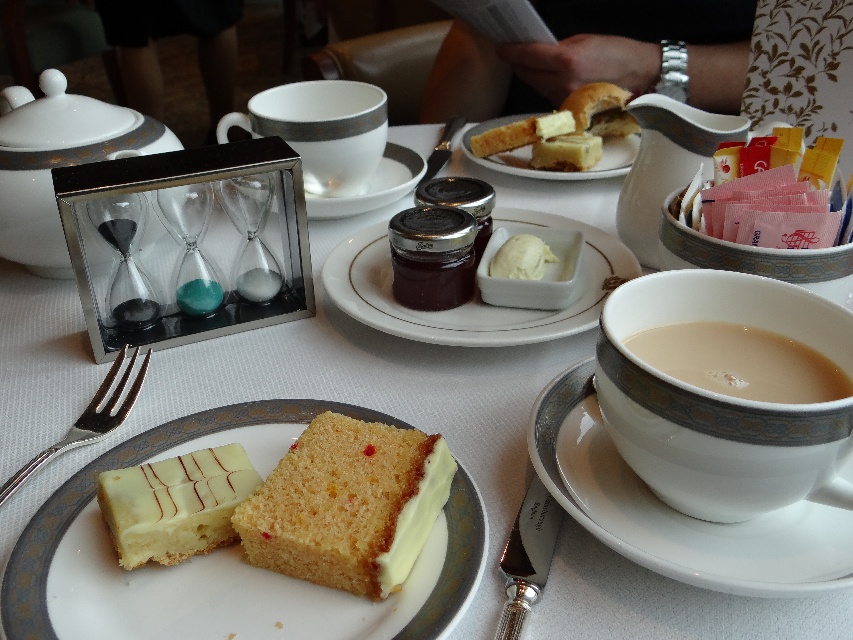
Does creamy porcelain cup at right come behind white ceramic saucer at right?

That is False.

Can you confirm if creamy porcelain cup at right is bigger than white ceramic saucer at right?

No.

Between point (659, 444) and point (804, 580), which one is positioned behind?

The point (659, 444) is behind.

Find the location of `creamy porcelain cup at right`. creamy porcelain cup at right is located at coordinates (722, 400).

Is point (764, 541) behind point (553, 227)?

No, (764, 541) is in front of (553, 227).

Between point (584, 410) and point (338, 262), which one is positioned behind?

The point (338, 262) is more distant.

The image size is (853, 640). What do you see at coordinates (676, 509) in the screenshot?
I see `white ceramic saucer at right` at bounding box center [676, 509].

The width and height of the screenshot is (853, 640). What are the coordinates of `white ceramic saucer at right` in the screenshot? It's located at (676, 509).

Between white ceramic saucer at right and white glossy cake at center, which one is positioned lower?

white glossy cake at center

Does white ceramic saucer at right have a smaller size compared to white glossy cake at center?

No.

Describe the element at coordinates (676, 509) in the screenshot. This screenshot has width=853, height=640. I see `white ceramic saucer at right` at that location.

Locate an element on the screen. white ceramic saucer at right is located at coordinates (676, 509).